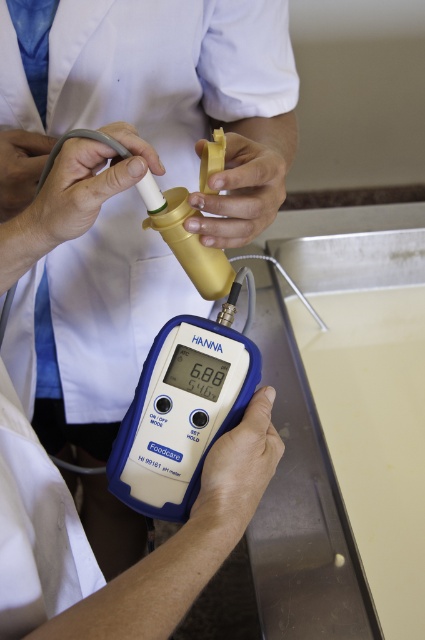
You are a lab assistant who needs to connect the matte yellow tube at center to the matte blue digital meter at lower center. Based on their positions, which object is closer to you and needs to be adjusted first?

The matte yellow tube at center is closer to you than the matte blue digital meter at lower center, so you should adjust the matte yellow tube at center first to ensure proper connection.

You are a lab technician observing the two tubes in the image. Which tube is closer to you, the matte yellow tube at center or the matte white tube at center?

The matte yellow tube at center is closer to you since the matte white tube at center is positioned behind it.